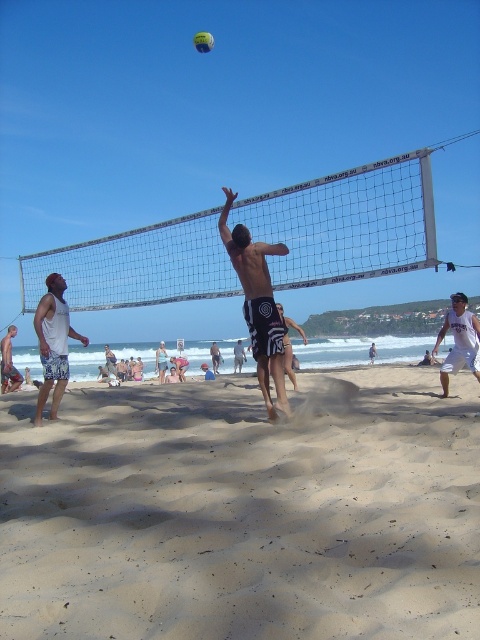
You are a photographer trying to capture the player in white textured shorts at left and shiny black shorts at center. Since you want to focus on the shorts, which one should you zoom in on to ensure the shorts are more detailed in the photo?

The shiny black shorts at center are thicker, so zooming in on them will show more details compared to the thinner white textured shorts at left.

You are a photographer trying to capture a candid shot of both players wearing white cotton shorts at right and white textured shorts at left. Since you want to ensure both are fully visible in the frame, which player should you position closer to the camera to avoid cropping?

You should position the white cotton shorts at right closer to the camera because it is shorter than the white textured shorts at left, so moving it forward ensures both will be fully visible in the frame.